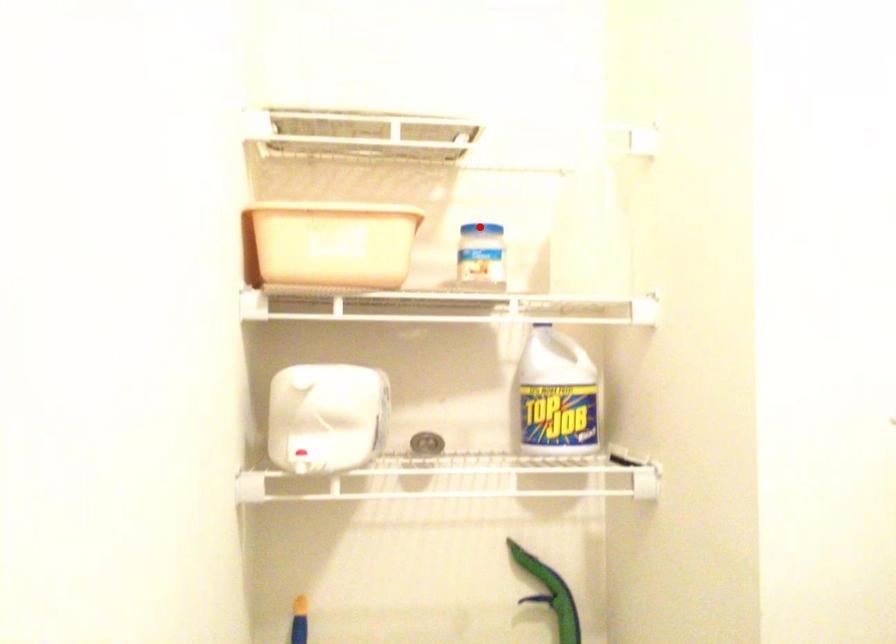
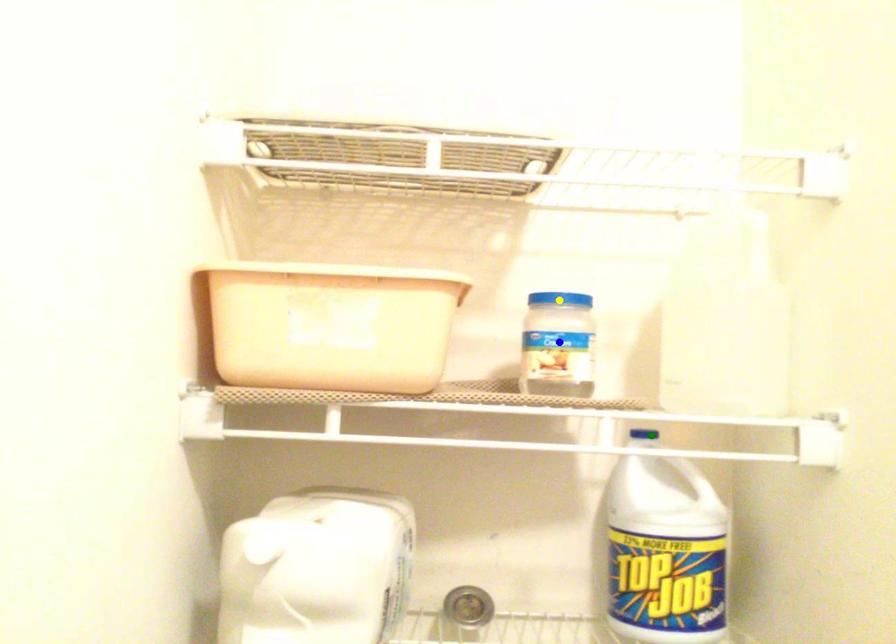
Question: I am providing you with two images of the same scene from different viewpoints. A red point is marked on the first image. You are given multiple points on the second image. Which point in image 2 is actually the same real-world point as the red point in image 1?

Choices:
 (A) green point
 (B) yellow point
 (C) blue point

Answer: (B)